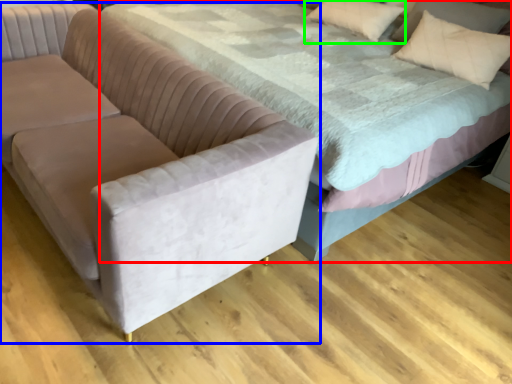
Question: Which is nearer to the bed (highlighted by a red box)? studio couch (highlighted by a blue box) or pillow (highlighted by a green box).

Choices:
 (A) studio couch
 (B) pillow

Answer: (A)